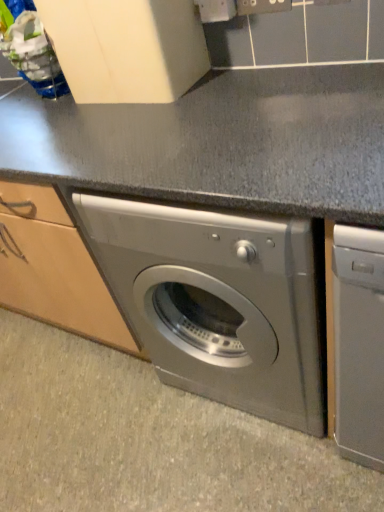
Locate an element on the screen. This screenshot has width=384, height=512. blank space above slate gray granite at center (from a real-world perspective) is located at coordinates (111, 410).